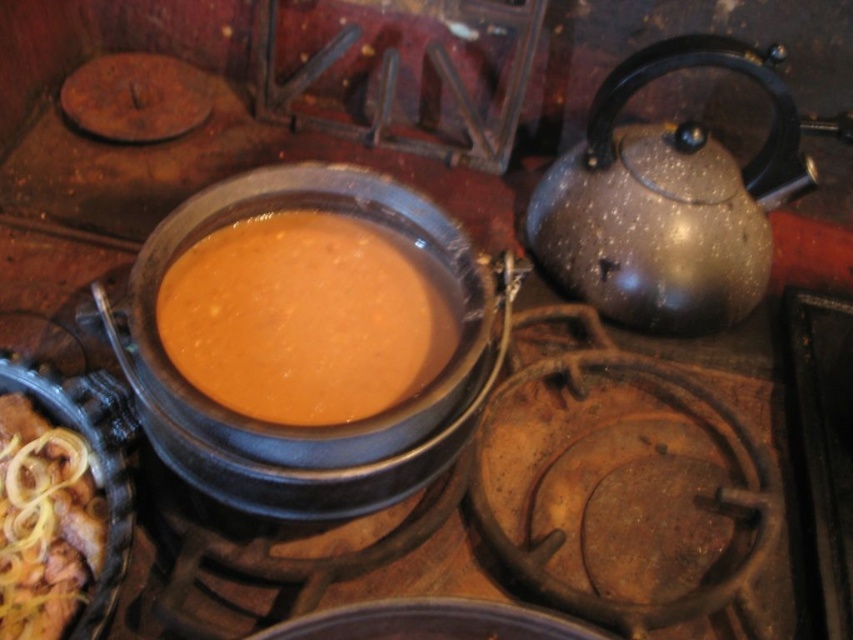
Is shiny metallic teapot at right below golden brown crispy onions at lower left?

Incorrect, shiny metallic teapot at right is not positioned below golden brown crispy onions at lower left.

The height and width of the screenshot is (640, 853). I want to click on shiny metallic teapot at right, so click(666, 200).

Who is lower down, shiny metallic teapot at right or orange matte soup at center?

Positioned lower is orange matte soup at center.

Can you confirm if shiny metallic teapot at right is taller than orange matte soup at center?

Yes.

The height and width of the screenshot is (640, 853). Describe the element at coordinates (666, 200) in the screenshot. I see `shiny metallic teapot at right` at that location.

Find the location of `shiny metallic teapot at right`. shiny metallic teapot at right is located at coordinates (666, 200).

Is point (410, 378) positioned in front of point (32, 436)?

Yes, point (410, 378) is closer to viewer.

Which of these two, orange matte soup at center or golden brown crispy onions at lower left, stands taller?

With more height is orange matte soup at center.

Find the location of a particular element. The height and width of the screenshot is (640, 853). orange matte soup at center is located at coordinates (303, 317).